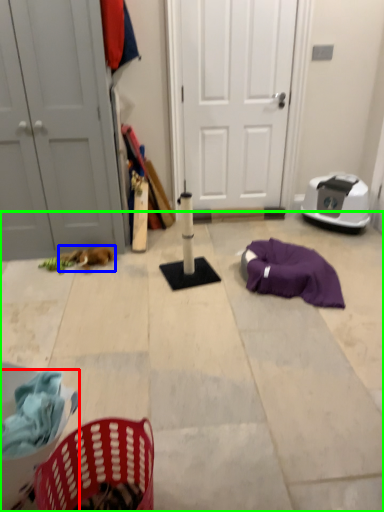
Question: Which object is positioned farthest from basket (highlighted by a red box)? Select from animal (highlighted by a blue box) and concrete (highlighted by a green box).

Choices:
 (A) animal
 (B) concrete

Answer: (A)